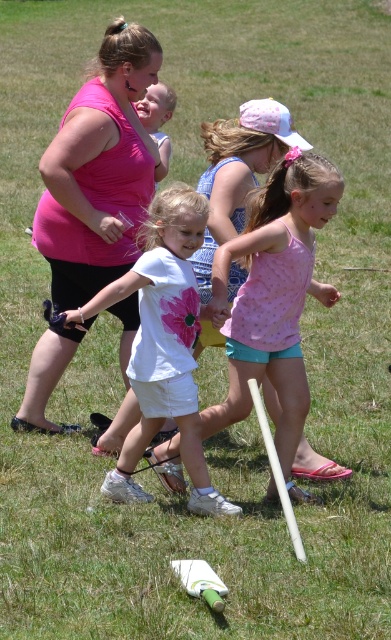
Can you confirm if white matte shorts at center is thinner than pink dotted tank top at center?

Correct, white matte shorts at center's width is less than pink dotted tank top at center's.

Which is more to the right, white matte shorts at center or pink dotted tank top at center?

Positioned to the right is pink dotted tank top at center.

Is point (188, 410) behind point (328, 300)?

No.

Find the location of a particular element. white matte shorts at center is located at coordinates (163, 344).

This screenshot has height=640, width=391. Describe the element at coordinates (100, 170) in the screenshot. I see `matte pink tank top at center` at that location.

Can you confirm if matte pink tank top at center is positioned above white matte shorts at center?

Indeed, matte pink tank top at center is positioned over white matte shorts at center.

Is point (129, 164) less distant than point (220, 502)?

No, it is behind (220, 502).

At what (x,y) coordinates should I click in order to perform the action: click on matte pink tank top at center. Please return your answer as a coordinate pair (x, y). Looking at the image, I should click on (100, 170).

Can you confirm if matte pink tank top at center is positioned to the left of pink matte shirt at center?

Yes, matte pink tank top at center is to the left of pink matte shirt at center.

Between matte pink tank top at center and pink matte shirt at center, which one appears on the right side from the viewer's perspective?

Positioned to the right is pink matte shirt at center.

You are a GUI agent. You are given a task and a screenshot of the screen. Output one action in this format:
    pyautogui.click(x=<x>, y=<y>)
    Task: Click on the matte pink tank top at center
    The image size is (391, 640).
    Given the screenshot: What is the action you would take?
    pyautogui.click(x=100, y=170)